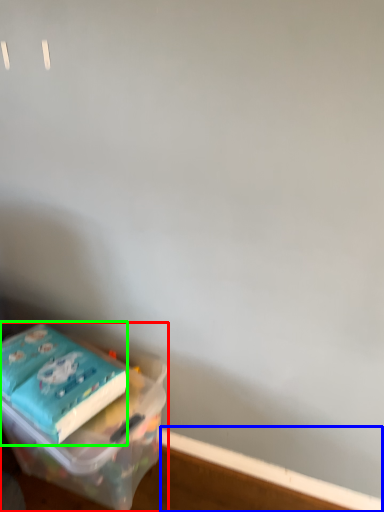
Question: Considering the real-world distances, which object is farthest from box (highlighted by a red box)? window sill (highlighted by a blue box) or paperback book (highlighted by a green box)?

Choices:
 (A) window sill
 (B) paperback book

Answer: (A)